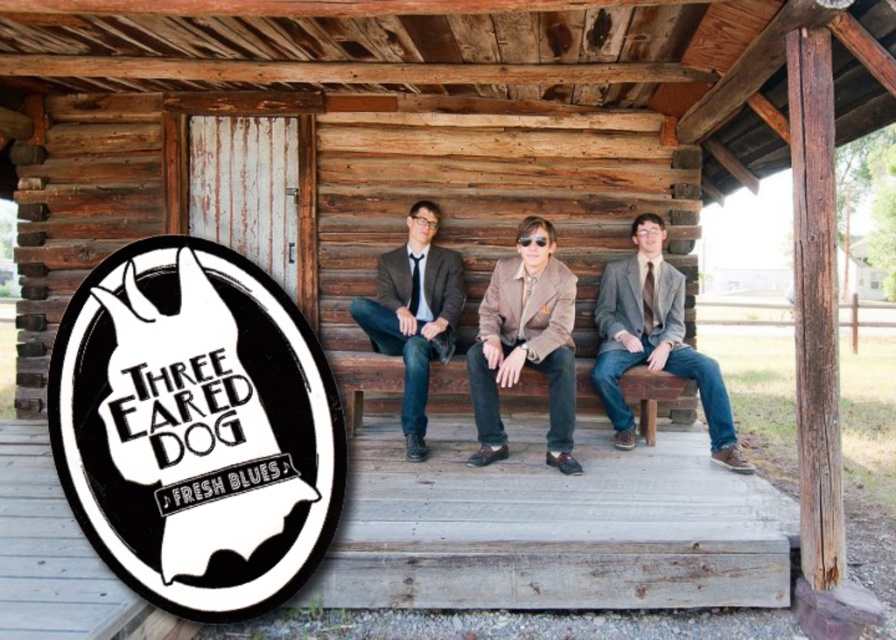
You are a photographer setting up for a group photo. You notice the black paper sign at left and the matte gray suit at center. Which object should you adjust to ensure both fit within the camera frame without cropping? Explain your reasoning.

The black paper sign at left has a larger width than the matte gray suit at center. Since the sign is wider, you should adjust its position to ensure it fits within the frame while keeping the matte gray suit at center in place.

Consider the image. You are a photographer setting up a shoot in front of a rustic log cabin. You have a matte gray suit at center and a brown wooden bench at center in your scene. Which object should you focus on first if you want to capture the subject sitting on the bench?

The matte gray suit at center is located above the brown wooden bench at center, so focusing on the matte gray suit at center would ensure the subject wearing it is captured sitting on the bench.

You are standing in front of the log cabin and want to place a small decorative item between the two points, point [434,205] and point [664,396]. Which point is closer to you so that the item can be placed in front of it?

Point [434,205] is closer to you than point [664,396], so placing the item in front of point [434,205] would position it closer to your current viewpoint.